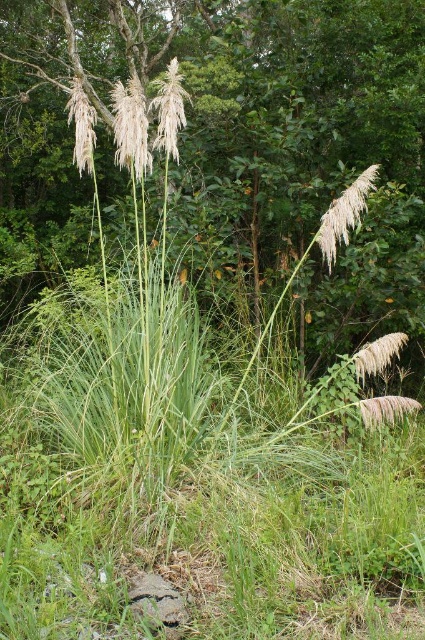
Between point (376, 163) and point (156, 116), which one is positioned behind?

Positioned behind is point (376, 163).

Can you confirm if white fluffy grass at upper right is positioned above green grass-like plant at center?

No.

The height and width of the screenshot is (640, 425). Identify the location of white fluffy grass at upper right. (345, 214).

The height and width of the screenshot is (640, 425). In order to click on white fluffy grass at upper right in this screenshot , I will do `click(345, 214)`.

Can you confirm if green grass-like plant at center is taller than silvery-green grass at upper left?

Yes, green grass-like plant at center is taller than silvery-green grass at upper left.

Describe the element at coordinates (169, 109) in the screenshot. This screenshot has height=640, width=425. I see `green grass-like plant at center` at that location.

Which is in front, point (169, 113) or point (88, 173)?

Point (169, 113) is more forward.

This screenshot has height=640, width=425. In order to click on green grass-like plant at center in this screenshot , I will do `click(169, 109)`.

Is point (113, 28) positioned before point (81, 141)?

That is False.

Between green grass at center and silvery-green grass at upper left, which one is positioned higher?

green grass at center

Who is more distant from viewer, (232, 67) or (82, 138)?

The point (232, 67) is behind.

Where is `green grass at center`? green grass at center is located at coordinates (282, 124).